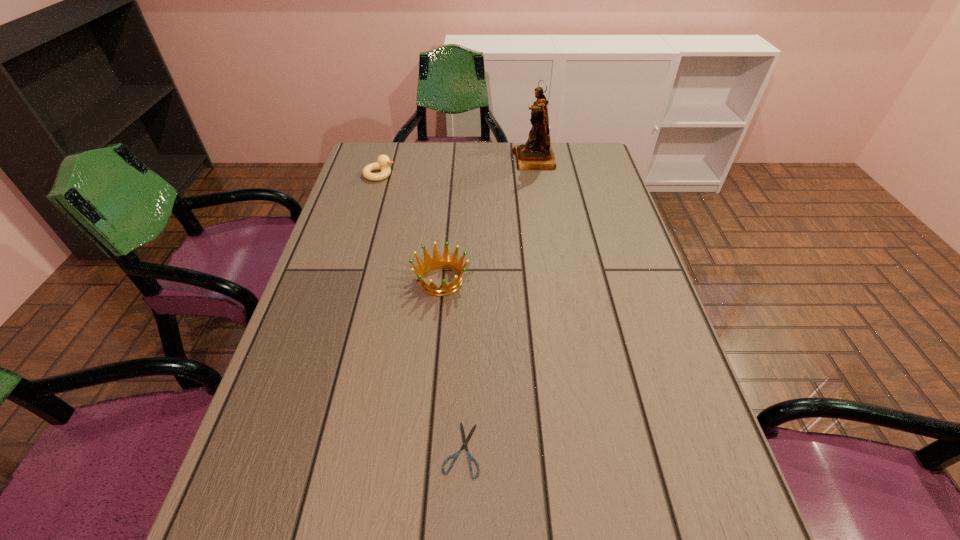
You are a GUI agent. You are given a task and a screenshot of the screen. Output one action in this format:
    pyautogui.click(x=<x>, y=<y>)
    Task: Click on the free space located 0.050m on the back of the crown
    This screenshot has width=960, height=540.
    Given the screenshot: What is the action you would take?
    pyautogui.click(x=444, y=249)

Identify the location of vacant area situated 0.200m on the right of the nearest object. (589, 449).

Identify the location of figurine at the far edge. Image resolution: width=960 pixels, height=540 pixels. (536, 154).

I want to click on duckling that is at the far edge, so click(x=383, y=161).

Locate an element on the screen. object that is at the left edge is located at coordinates (383, 161).

Locate an element on the screen. The height and width of the screenshot is (540, 960). object that is at the right edge is located at coordinates (536, 154).

Where is `object present at the far left corner`? The height and width of the screenshot is (540, 960). object present at the far left corner is located at coordinates (383, 161).

You are a GUI agent. You are given a task and a screenshot of the screen. Output one action in this format:
    pyautogui.click(x=<x>, y=<y>)
    Task: Click on the object situated at the far right corner
    
    Given the screenshot: What is the action you would take?
    pyautogui.click(x=536, y=154)

What are the coordinates of `vacant space at the far edge of the desktop` in the screenshot? It's located at (464, 145).

This screenshot has height=540, width=960. In the image, there is a desktop. Identify the location of vacant space at the left edge. (359, 331).